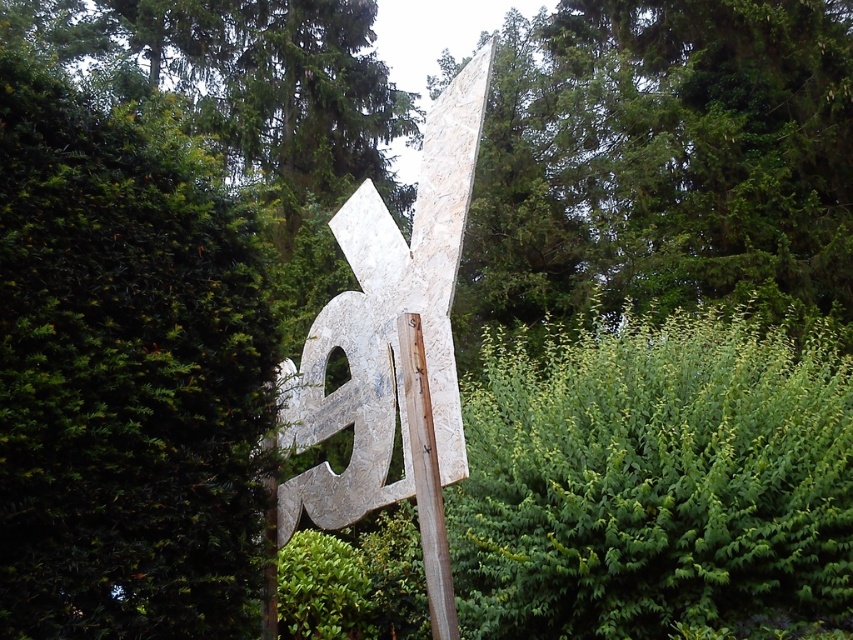
Question: From the image, what is the correct spatial relationship of rusty metal sign at center in relation to wooden pole at center?

Choices:
 (A) above
 (B) below

Answer: (A)

Question: Is rusty metal sign at center thinner than wooden pole at center?

Choices:
 (A) no
 (B) yes

Answer: (A)

Question: Can you confirm if rusty metal sign at center is smaller than wooden pole at center?

Choices:
 (A) no
 (B) yes

Answer: (A)

Question: Which of the following is the farthest from the observer?

Choices:
 (A) rusty metal sign at center
 (B) wooden pole at center

Answer: (A)

Question: Which of the following is the farthest from the observer?

Choices:
 (A) wooden pole at center
 (B) rusty metal sign at center

Answer: (B)

Question: Which object is closer to the camera taking this photo?

Choices:
 (A) rusty metal sign at center
 (B) wooden pole at center

Answer: (B)